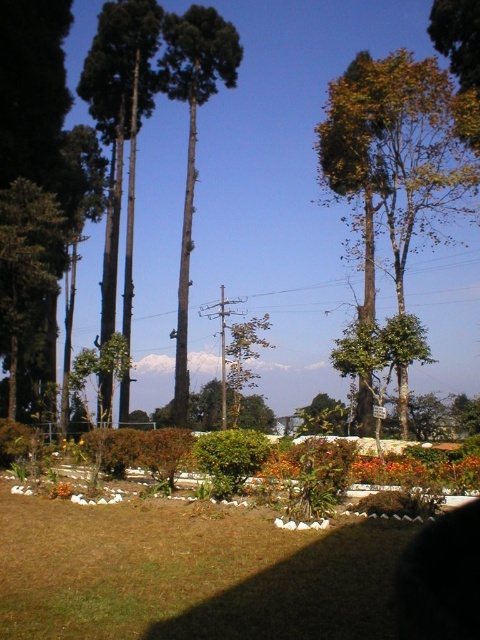
Does point (393, 145) come farther from viewer compared to point (10, 362)?

Yes, it is.

Is green leafy tree at upper right shorter than green matte tree at left?

In fact, green leafy tree at upper right may be taller than green matte tree at left.

This screenshot has width=480, height=640. I want to click on green leafy tree at upper right, so click(x=396, y=156).

Does green matte tree at center appear on the right side of green rough bark tree at center?

Yes, green matte tree at center is to the right of green rough bark tree at center.

The height and width of the screenshot is (640, 480). I want to click on green matte tree at center, so click(x=120, y=124).

Between green matte tree at center and orange matte flower at lower left, which one is positioned higher?

green matte tree at center is higher up.

In order to click on green matte tree at center in this screenshot , I will do `click(120, 124)`.